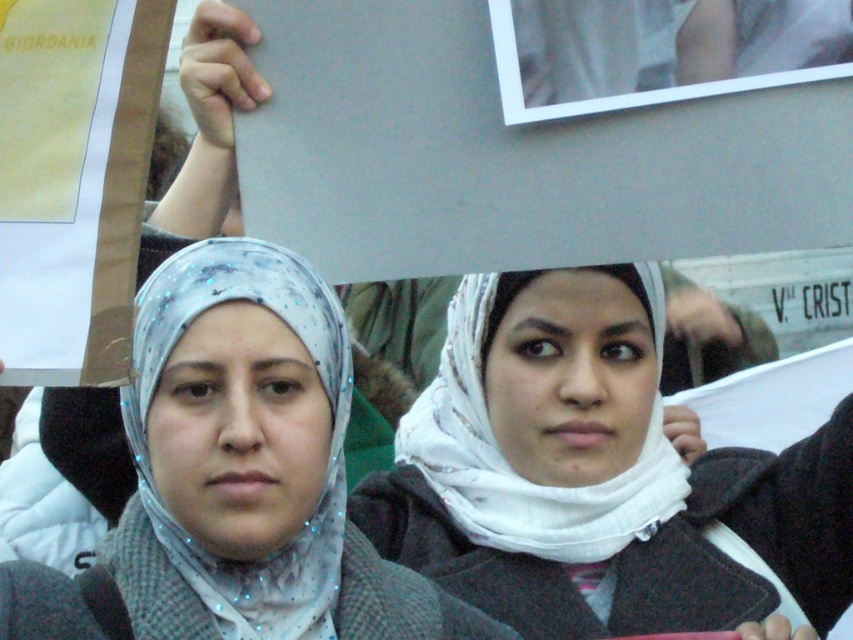
You are a photographer trying to capture a closeup shot of the white fabric headscarf at center and the matte gray scarf at center. Since you want to focus on the details of both scarves, which one should you zoom in on first to ensure it fills the frame adequately?

The white fabric headscarf at center is larger in size compared to the matte gray scarf at center, so you should zoom in on the white fabric headscarf at center first to ensure it fills the frame adequately before adjusting for the smaller matte gray scarf at center.

You are a photographer trying to capture a closeup shot of both the white fabric headscarf at center and the matte gray scarf at center in the image. Given that your camera can only focus on objects within a 20 inch range, will you be able to capture both in focus?

The distance between the white fabric headscarf at center and the matte gray scarf at center is 22.24 inches, which exceeds the 20 inch focus range of your camera. Therefore, you cannot capture both in focus simultaneously.

You are a photographer trying to capture a closeup of the white fabric headscarf at center and the matte gray scarf at center. Since both are in the same frame, which one should you adjust your camera to focus on first to ensure it appears sharp in the photo?

The white fabric headscarf at center is to the right of the matte gray scarf at center. Since the photographer wants both in focus, adjusting focus starting from the closer object would help. However, based on spatial positioning alone, focusing on the matte gray scarf at center first might be necessary as it is to the left and potentially closer in depth, but without depth info, the question can only address position. The question might need rephrasing for clarity.